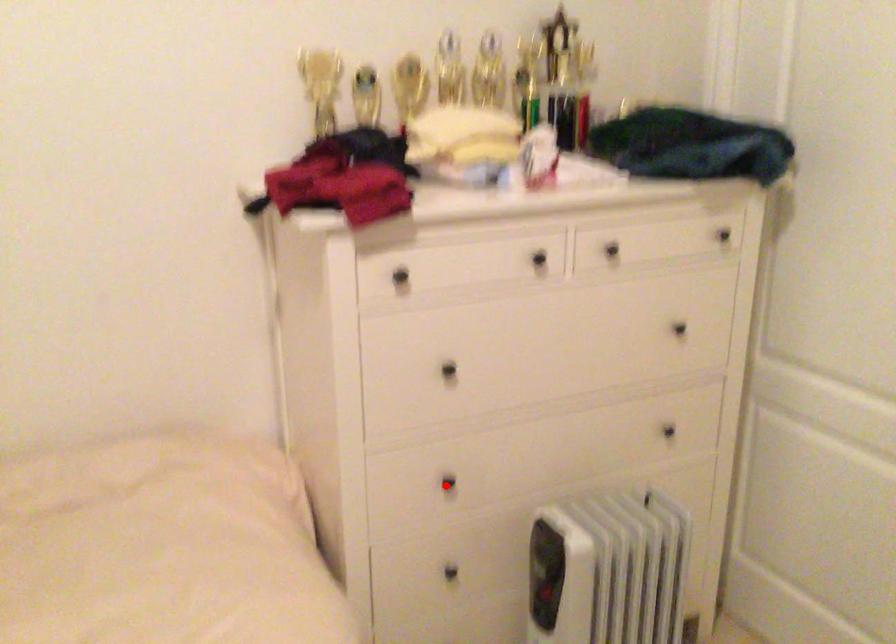
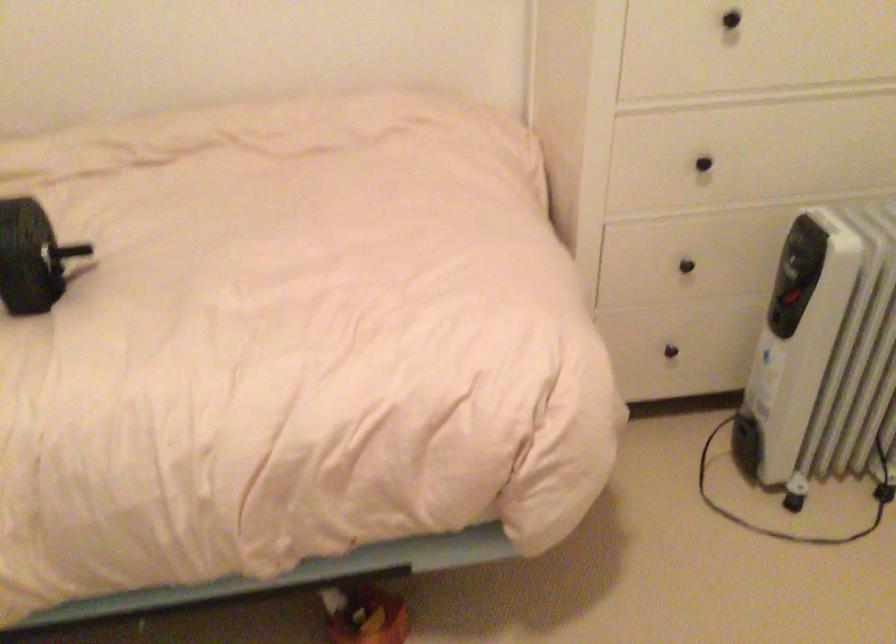
Question: I am providing you with two images of the same scene from different viewpoints. A red point is marked on the first image. Can you still see the location of the red point in image 2?

Choices:
 (A) Yes
 (B) No

Answer: (A)